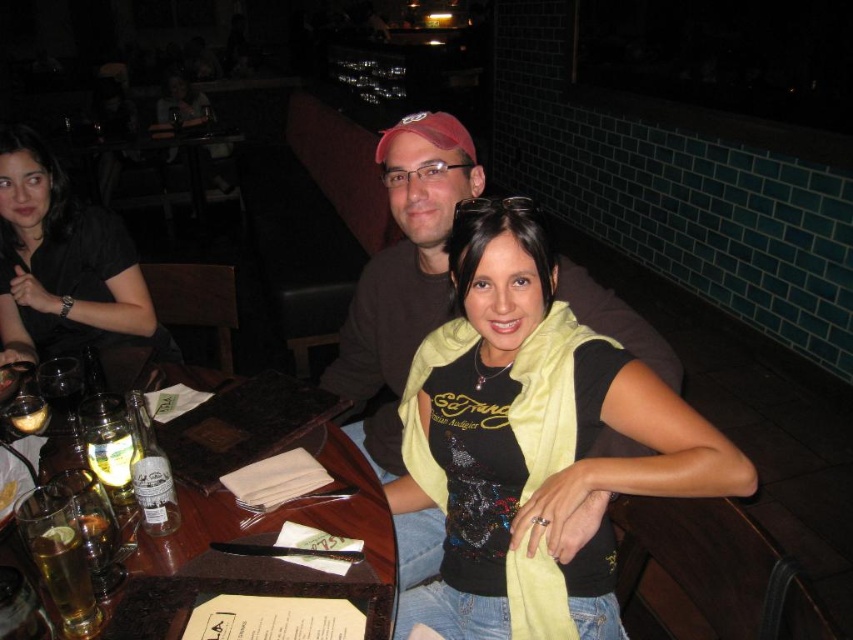
Question: Which point is closer to the camera?

Choices:
 (A) (111, 611)
 (B) (67, 532)
 (C) (9, 284)

Answer: (B)

Question: Which of the following is the closest to the observer?

Choices:
 (A) (41, 548)
 (B) (515, 348)
 (C) (271, 579)

Answer: (A)

Question: Is matte black shirt at upper left bigger than translucent glass beer at lower left?

Choices:
 (A) yes
 (B) no

Answer: (A)

Question: Estimate the real-world distances between objects in this image. Which object is closer to the satin yellow scarf at center?

Choices:
 (A) matte black shirt at upper left
 (B) wooden table at lower left

Answer: (B)

Question: Can you confirm if matte black shirt at upper left is positioned above translucent glass beer at lower left?

Choices:
 (A) no
 (B) yes

Answer: (B)

Question: Can you confirm if satin yellow scarf at center is bigger than translucent glass beer at lower left?

Choices:
 (A) no
 (B) yes

Answer: (B)